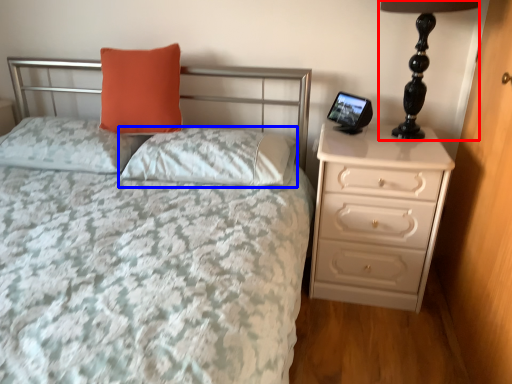
Question: Which point is closer to the camera, table lamp (highlighted by a red box) or pillow (highlighted by a blue box)?

Choices:
 (A) table lamp
 (B) pillow

Answer: (A)